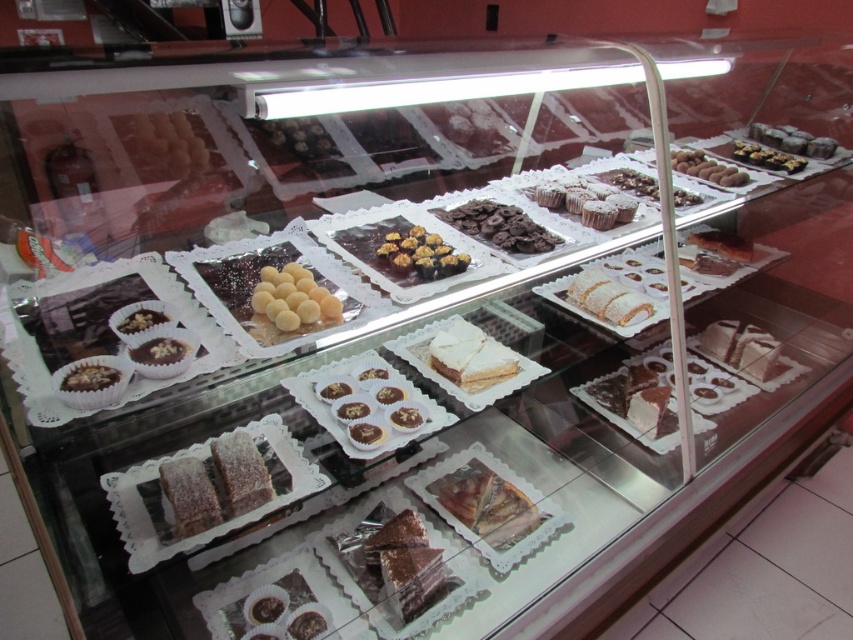
Which is above, white sugared balls at center or chocolate-coated nuts at upper right?

chocolate-coated nuts at upper right

Who is more distant from viewer, (306, 308) or (788, 170)?

Positioned behind is point (788, 170).

What do you see at coordinates (294, 300) in the screenshot?
I see `white sugared balls at center` at bounding box center [294, 300].

Identify the location of white sugared balls at center. (294, 300).

Looking at this image, can you confirm if chocolate cake at center is positioned above powdered white cake at center?

Incorrect, chocolate cake at center is not positioned above powdered white cake at center.

Is chocolate cake at center to the right of powdered white cake at center from the viewer's perspective?

Incorrect, chocolate cake at center is not on the right side of powdered white cake at center.

At what (x,y) coordinates should I click in order to perform the action: click on chocolate cake at center. Please return your answer as a coordinate pair (x, y). This screenshot has height=640, width=853. Looking at the image, I should click on (486, 504).

You are a GUI agent. You are given a task and a screenshot of the screen. Output one action in this format:
    pyautogui.click(x=<x>, y=<y>)
    Task: Click on the chocolate cake at center
    Image resolution: width=853 pixels, height=640 pixels.
    Given the screenshot: What is the action you would take?
    pyautogui.click(x=486, y=504)

Who is shorter, chocolate cake at center or chocolate-coated nuts at upper right?

With less height is chocolate cake at center.

Which is more to the right, chocolate cake at center or chocolate-coated nuts at upper right?

chocolate-coated nuts at upper right is more to the right.

Locate an element on the screen. chocolate cake at center is located at coordinates (486, 504).

Locate an element on the screen. This screenshot has height=640, width=853. chocolate cake at center is located at coordinates (486, 504).